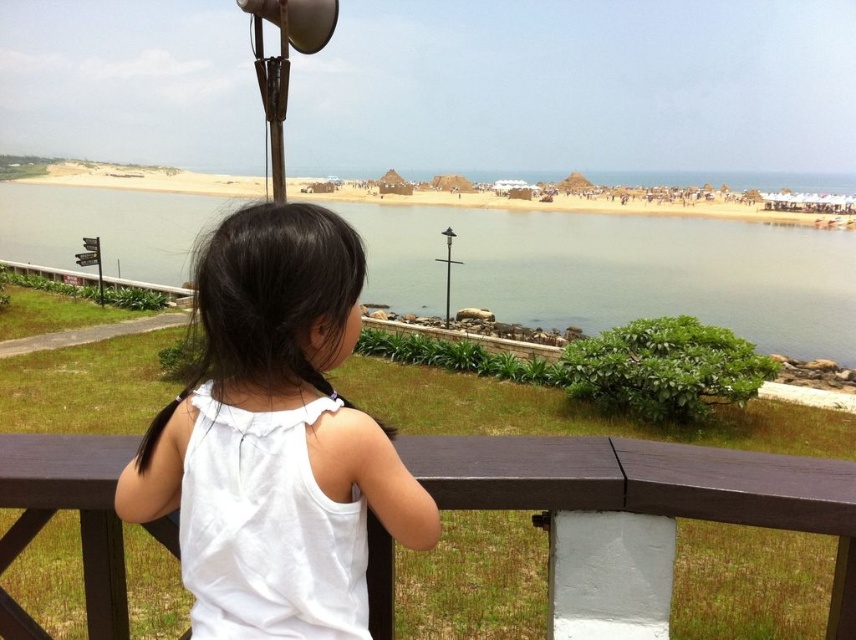
Question: Estimate the real-world distances between objects in this image. Which object is closer to the clear blue water at center?

Choices:
 (A) white cotton shirt at center
 (B) brown wooden balustrade at center

Answer: (A)

Question: Is clear blue water at center wider than sandy beach at center?

Choices:
 (A) no
 (B) yes

Answer: (A)

Question: Does white cotton shirt at center have a greater width compared to sandy beach at center?

Choices:
 (A) yes
 (B) no

Answer: (B)

Question: Which of the following is the closest to the observer?

Choices:
 (A) sandy beach at center
 (B) white cotton shirt at center

Answer: (B)

Question: Among these objects, which one is farthest from the camera?

Choices:
 (A) sandy beach at center
 (B) clear blue water at center
 (C) brown wooden balustrade at center

Answer: (B)

Question: Is clear blue water at center above sandy beach at center?

Choices:
 (A) no
 (B) yes

Answer: (A)